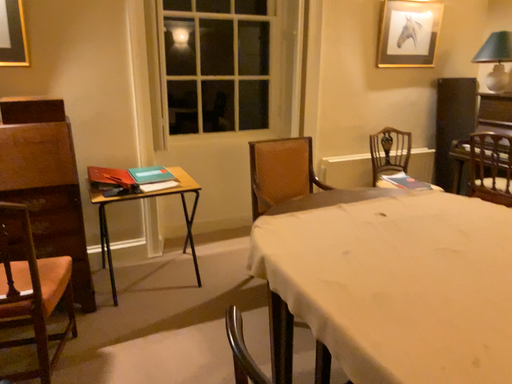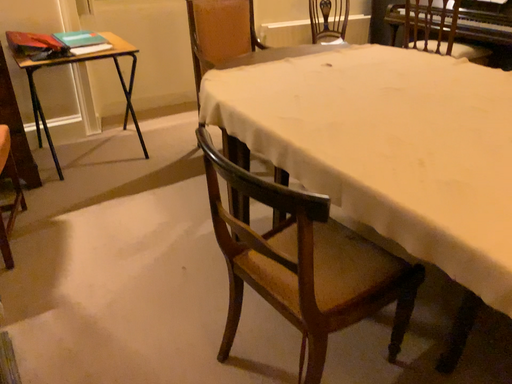
Question: Which way did the camera rotate in the video?

Choices:
 (A) rotated upward
 (B) rotated downward

Answer: (B)